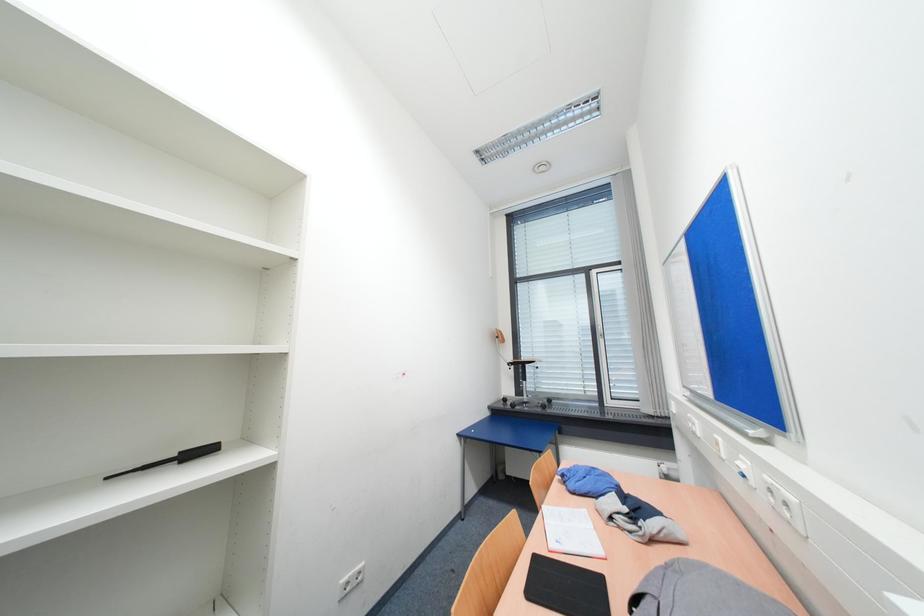
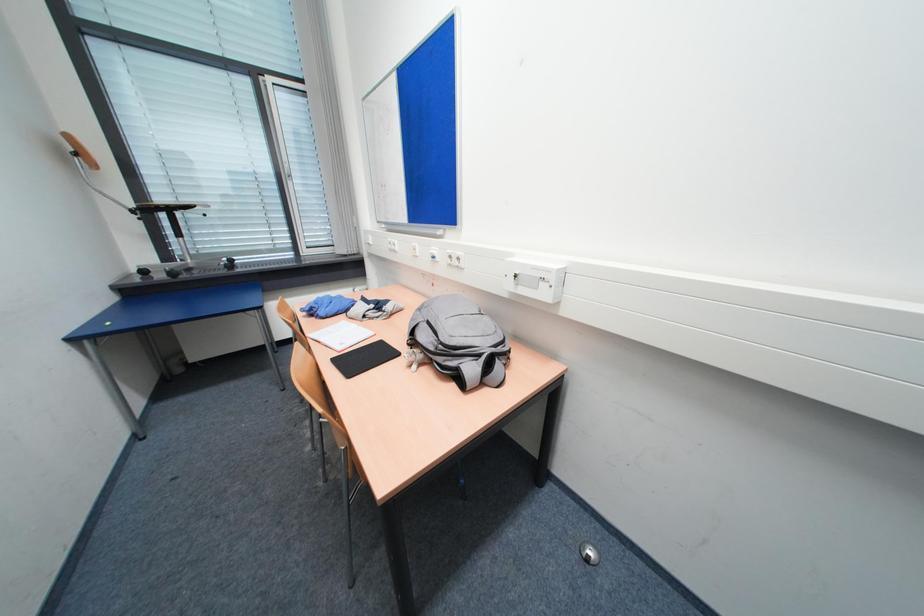
Based on the continuous images, in which direction is the camera rotating?

The camera rotated toward right-down.